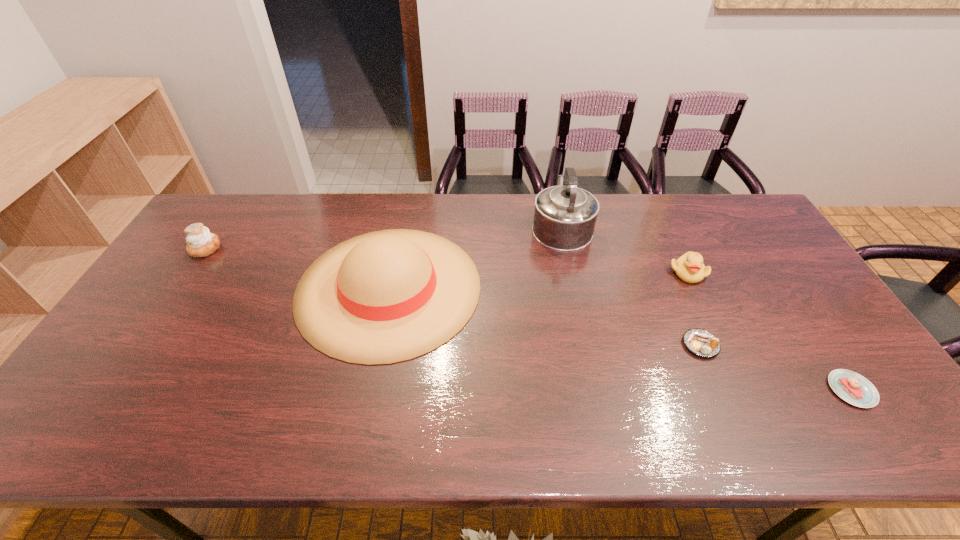
This screenshot has height=540, width=960. I want to click on free space that satisfies the following two spatial constraints: 1. at the face of the duckling; 2. on the right side of the rightmost pastry, so click(x=744, y=390).